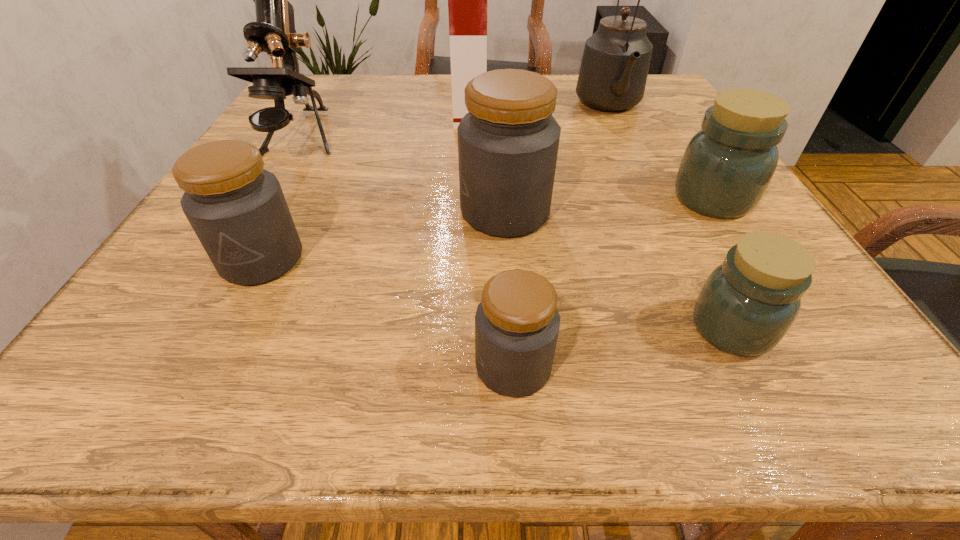
At what (x,y) coordinates should I click in order to perform the action: click on microscope. Please return your answer as a coordinate pair (x, y). This screenshot has width=960, height=540. Looking at the image, I should click on (273, 32).

Where is `red cigarette_case`? The width and height of the screenshot is (960, 540). red cigarette_case is located at coordinates (467, 0).

The height and width of the screenshot is (540, 960). What are the coordinates of `kettle` in the screenshot? It's located at (613, 73).

This screenshot has height=540, width=960. What are the coordinates of `the biggest gray jar` in the screenshot? It's located at (508, 142).

This screenshot has width=960, height=540. What are the coordinates of `the tallest jar` in the screenshot? It's located at (508, 142).

You are a GUI agent. You are given a task and a screenshot of the screen. Output one action in this format:
    pyautogui.click(x=<x>, y=<y>)
    Task: Click on the bigger green jar
    
    Given the screenshot: What is the action you would take?
    pyautogui.click(x=727, y=166)

At what (x,y) coordinates should I click in order to perform the action: click on the second biggest gray jar. Please return your answer as a coordinate pair (x, y). Looking at the image, I should click on (237, 209).

Find the location of `the leftmost gray jar`. the leftmost gray jar is located at coordinates (237, 209).

Image resolution: width=960 pixels, height=540 pixels. I want to click on the nearer green jar, so click(x=746, y=306).

Image resolution: width=960 pixels, height=540 pixels. Identify the location of the nearest gray jar. (517, 324).